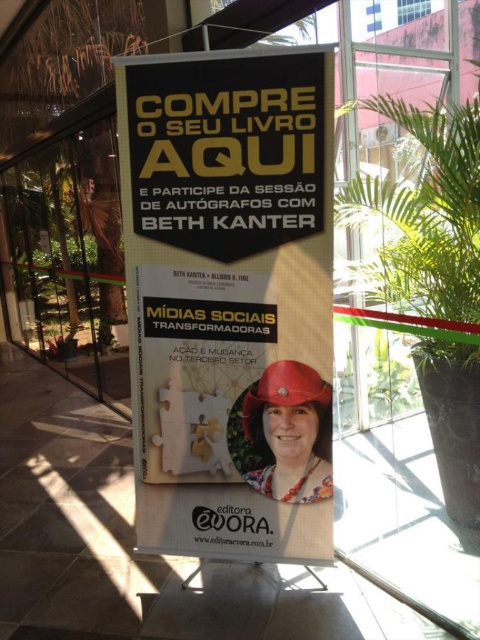
What are the coordinates of the black paper poster at center?

The black paper poster at center is located at point [229,300].

You are a customer standing in front of the promotional banner. You see a green leafy plant at center and a matte red helmet at center. Which object is positioned to the right side?

The green leafy plant at center is positioned to the right of the matte red helmet at center.

You are a photographer trying to take a clear photo of the black paper poster at center and the green leafy plant at center. Which object should you focus on first to ensure both are in focus?

The black paper poster at center is closer to the viewer than the green leafy plant at center, so you should focus on the black paper poster at center first to ensure both are in focus.